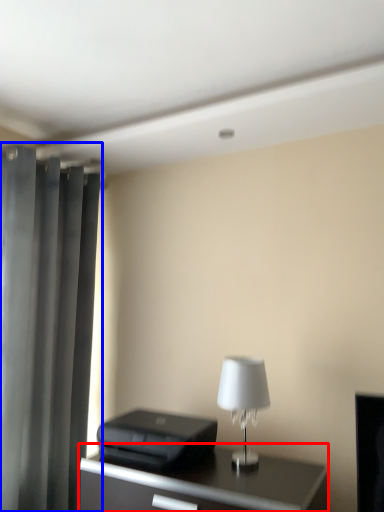
Question: Among these objects, which one is farthest to the camera, table (highlighted by a red box) or curtain (highlighted by a blue box)?

Choices:
 (A) table
 (B) curtain

Answer: (B)